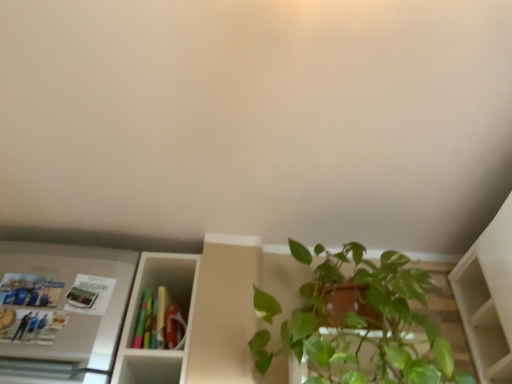
Question: Considering the relative positions of green glossy plant at lower right and matte plastic book at center in the image provided, is green glossy plant at lower right to the left of matte plastic book at center from the viewer's perspective?

Choices:
 (A) yes
 (B) no

Answer: (B)

Question: Is green glossy plant at lower right placed right next to matte plastic book at center?

Choices:
 (A) no
 (B) yes

Answer: (A)

Question: Is green glossy plant at lower right turned away from matte plastic book at center?

Choices:
 (A) no
 (B) yes

Answer: (A)

Question: From the image's perspective, is green glossy plant at lower right located beneath matte plastic book at center?

Choices:
 (A) no
 (B) yes

Answer: (A)

Question: Is green glossy plant at lower right shorter than matte plastic book at center?

Choices:
 (A) no
 (B) yes

Answer: (A)

Question: Considering the positions of point tap(47, 375) and point tap(252, 342), is point tap(47, 375) closer or farther from the camera than point tap(252, 342)?

Choices:
 (A) closer
 (B) farther

Answer: (B)

Question: In the image, is metallic silver fridge at left positioned in front of or behind green glossy plant at lower right?

Choices:
 (A) front
 (B) behind

Answer: (B)

Question: From the image's perspective, is metallic silver fridge at left located above or below green glossy plant at lower right?

Choices:
 (A) below
 (B) above

Answer: (A)

Question: Is metallic silver fridge at left taller or shorter than green glossy plant at lower right?

Choices:
 (A) tall
 (B) short

Answer: (B)

Question: Based on their positions, is metallic silver fridge at left located to the left or right of matte plastic book at center?

Choices:
 (A) right
 (B) left

Answer: (B)

Question: Is metallic silver fridge at left taller or shorter than matte plastic book at center?

Choices:
 (A) tall
 (B) short

Answer: (A)

Question: From the image's perspective, is metallic silver fridge at left located above or below matte plastic book at center?

Choices:
 (A) above
 (B) below

Answer: (A)

Question: Considering the positions of metallic silver fridge at left and matte plastic book at center in the image, is metallic silver fridge at left wider or thinner than matte plastic book at center?

Choices:
 (A) thin
 (B) wide

Answer: (A)

Question: Considering the positions of green glossy plant at lower right and matte plastic book at center in the image, is green glossy plant at lower right wider or thinner than matte plastic book at center?

Choices:
 (A) wide
 (B) thin

Answer: (A)

Question: Choose the correct answer: Is green glossy plant at lower right inside matte plastic book at center or outside it?

Choices:
 (A) outside
 (B) inside

Answer: (A)